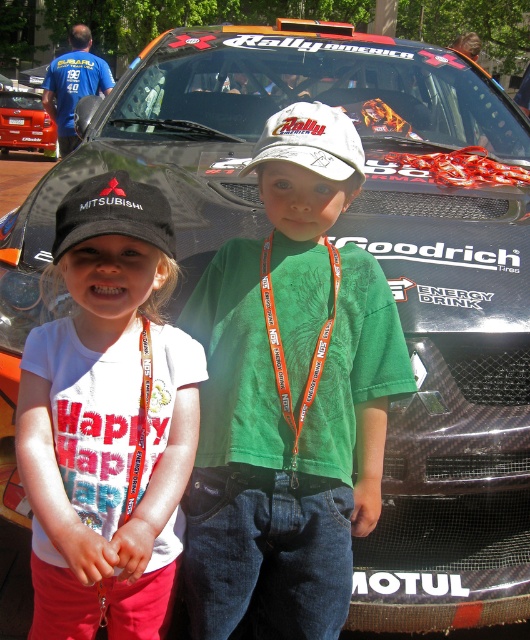
Question: Does green fabric shirt at center come in front of white matte baseball cap at center?

Choices:
 (A) yes
 (B) no

Answer: (A)

Question: Is white cotton shirt at center smaller than metallic red car at left?

Choices:
 (A) yes
 (B) no

Answer: (A)

Question: Is white matte baseball cap at center bigger than metallic red car at left?

Choices:
 (A) yes
 (B) no

Answer: (B)

Question: Which object appears farthest from the camera in this image?

Choices:
 (A) white matte baseball cap at center
 (B) white cotton shirt at center
 (C) orange lanyard at center
 (D) metallic red car at left

Answer: (D)

Question: Which point is farther from the camera taking this photo?

Choices:
 (A) (61, 208)
 (B) (282, 582)
 (C) (272, 355)

Answer: (B)

Question: Which object is the closest to the metallic red car at left?

Choices:
 (A) green fabric shirt at center
 (B) black fabric cap at left
 (C) white cotton shirt at center
 (D) orange lanyard at center

Answer: (A)